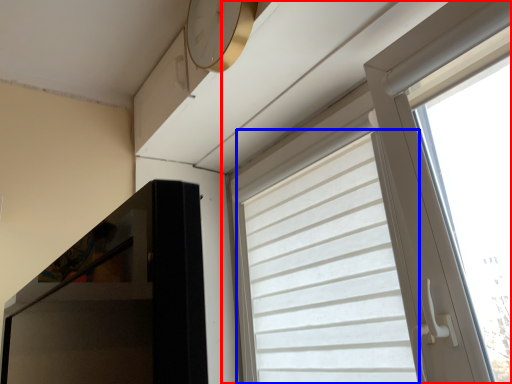
Question: Which object is closer to the camera taking this photo, window (highlighted by a red box) or curtain (highlighted by a blue box)?

Choices:
 (A) window
 (B) curtain

Answer: (A)